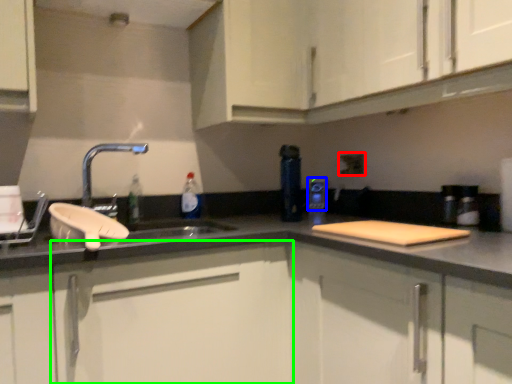
Question: Which object is the closest to the electric outlet (highlighted by a red box)? Choose among these: appliance (highlighted by a blue box) or cabinetry (highlighted by a green box).

Choices:
 (A) appliance
 (B) cabinetry

Answer: (A)